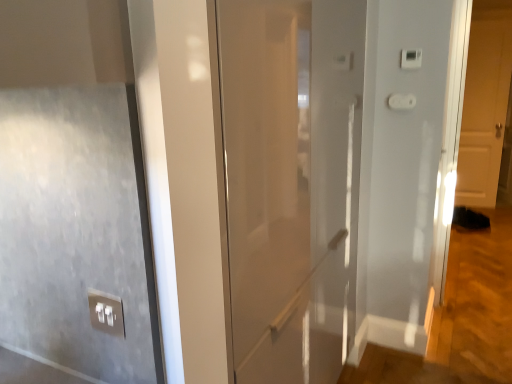
Question: Is white plastic light switch at upper right, the 2th light switch in the top-to-bottom sequence, surrounded by white glossy door at center, which ranks as the first door in front-to-back order?

Choices:
 (A) yes
 (B) no

Answer: (B)

Question: Does white glossy door at center, which ranks as the first door in front-to-back order, lie in front of white plastic light switch at upper right, the 1th light switch ordered from the bottom?

Choices:
 (A) yes
 (B) no

Answer: (A)

Question: Is white glossy door at center, acting as the second door starting from the right, shorter than white plastic light switch at upper right, the 2th light switch in the top-to-bottom sequence?

Choices:
 (A) yes
 (B) no

Answer: (B)

Question: Can you confirm if white glossy door at center, acting as the second door starting from the right, is positioned to the left of white plastic light switch at upper right, the 1th light switch ordered from the bottom?

Choices:
 (A) yes
 (B) no

Answer: (A)

Question: Considering the relative sizes of white glossy door at center, the second door in the back-to-front sequence, and white plastic light switch at upper right, the 2th light switch in the top-to-bottom sequence, in the image provided, is white glossy door at center, the second door in the back-to-front sequence, wider than white plastic light switch at upper right, the 2th light switch in the top-to-bottom sequence,?

Choices:
 (A) yes
 (B) no

Answer: (A)

Question: Could you tell me if white glossy door at center, the second door in the back-to-front sequence, is turned towards white plastic light switch at upper right, the 2th light switch in the top-to-bottom sequence?

Choices:
 (A) yes
 (B) no

Answer: (B)

Question: Considering the relative sizes of white matte door at right, marked as the 2th door in a left-to-right arrangement, and white plastic light switch at upper right, acting as the second light switch starting from the bottom, in the image provided, is white matte door at right, marked as the 2th door in a left-to-right arrangement, shorter than white plastic light switch at upper right, acting as the second light switch starting from the bottom,?

Choices:
 (A) no
 (B) yes

Answer: (A)

Question: Is white matte door at right, marked as the 2th door in a left-to-right arrangement, positioned with its back to white plastic light switch at upper right, acting as the second light switch starting from the bottom?

Choices:
 (A) yes
 (B) no

Answer: (B)

Question: Is white matte door at right, arranged as the 1th door when viewed from the back, closer to the viewer compared to white plastic light switch at upper right, acting as the 1th light switch starting from the top?

Choices:
 (A) yes
 (B) no

Answer: (B)

Question: From the image's perspective, is white matte door at right, marked as the 2th door in a left-to-right arrangement, below white plastic light switch at upper right, acting as the 1th light switch starting from the top?

Choices:
 (A) yes
 (B) no

Answer: (B)

Question: Is white matte door at right, arranged as the first door when viewed from the right, at the right side of white plastic light switch at upper right, acting as the second light switch starting from the bottom?

Choices:
 (A) yes
 (B) no

Answer: (A)

Question: Can you confirm if white matte door at right, arranged as the 1th door when viewed from the back, is positioned to the left of white plastic light switch at upper right, acting as the second light switch starting from the bottom?

Choices:
 (A) yes
 (B) no

Answer: (B)

Question: Is satin silver switch at lower left oriented towards white plastic light switch at upper right, the 2th light switch in the top-to-bottom sequence?

Choices:
 (A) yes
 (B) no

Answer: (B)